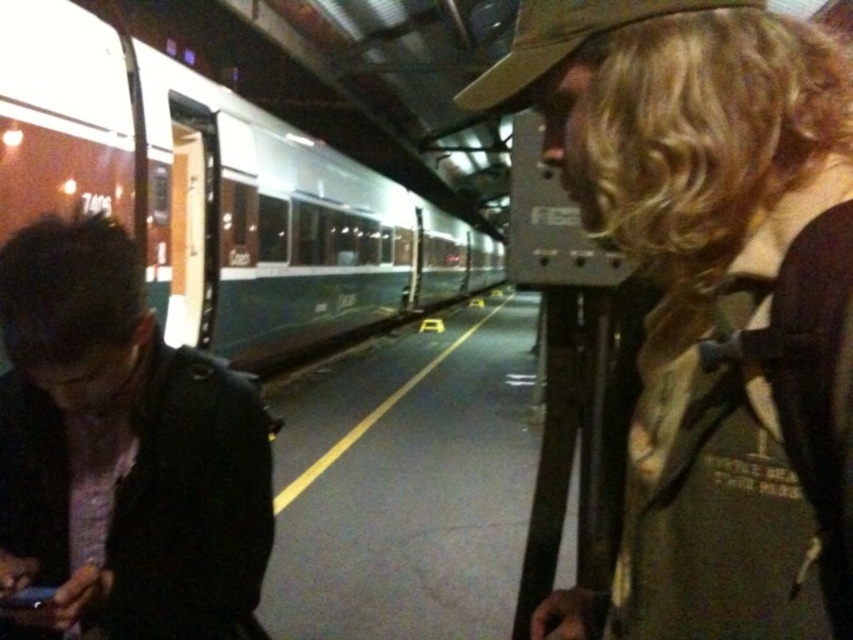
Is point (62, 33) closer to viewer compared to point (181, 348)?

No, (62, 33) is behind (181, 348).

Does green matte train at left appear under dark brown leather jacket at lower left?

Incorrect, green matte train at left is not positioned below dark brown leather jacket at lower left.

The image size is (853, 640). I want to click on green matte train at left, so click(213, 193).

Can you confirm if camouflage backpack at center is positioned to the left of dark brown leather jacket at lower left?

No, camouflage backpack at center is not to the left of dark brown leather jacket at lower left.

Who is taller, camouflage backpack at center or dark brown leather jacket at lower left?

With more height is camouflage backpack at center.

The height and width of the screenshot is (640, 853). I want to click on camouflage backpack at center, so click(x=711, y=301).

Locate an element on the screen. The image size is (853, 640). camouflage backpack at center is located at coordinates (711, 301).

Is camouflage backpack at center in front of green matte train at left?

Yes, camouflage backpack at center is in front of green matte train at left.

Is point (547, 1) in front of point (277, 260)?

Yes, it is in front of point (277, 260).

The height and width of the screenshot is (640, 853). Identify the location of camouflage backpack at center. (711, 301).